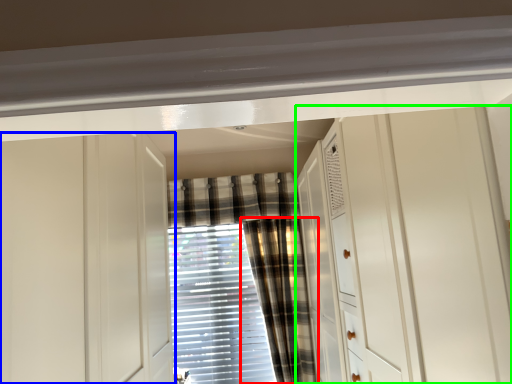
Question: Considering the real-world distances, which object is farthest from curtain (highlighted by a red box)? cabinetry (highlighted by a blue box) or dresser (highlighted by a green box)?

Choices:
 (A) cabinetry
 (B) dresser

Answer: (A)